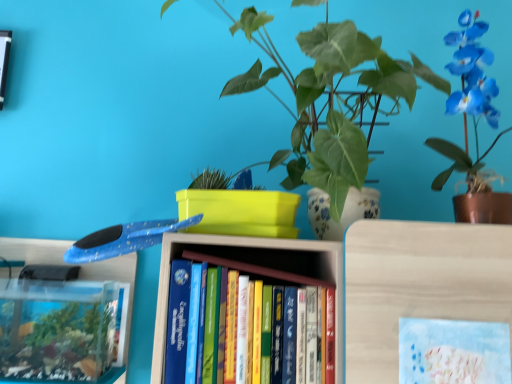
Question: Considering the relative sizes of green glossy leafy plant at center, marked as the 1th houseplant in a left-to-right arrangement, and pastel blue paper at center in the image provided, is green glossy leafy plant at center, marked as the 1th houseplant in a left-to-right arrangement, thinner than pastel blue paper at center?

Choices:
 (A) yes
 (B) no

Answer: (B)

Question: Is green glossy leafy plant at center, marked as the 1th houseplant in a left-to-right arrangement, positioned far away from pastel blue paper at center?

Choices:
 (A) no
 (B) yes

Answer: (A)

Question: From the image's perspective, would you say green glossy leafy plant at center, which is counted as the 2th houseplant, starting from the right, is positioned over pastel blue paper at center?

Choices:
 (A) no
 (B) yes

Answer: (B)

Question: Does green glossy leafy plant at center, which is counted as the 2th houseplant, starting from the right, have a lesser height compared to pastel blue paper at center?

Choices:
 (A) yes
 (B) no

Answer: (B)

Question: Considering the relative sizes of green glossy leafy plant at center, which is counted as the 2th houseplant, starting from the right, and pastel blue paper at center in the image provided, is green glossy leafy plant at center, which is counted as the 2th houseplant, starting from the right, taller than pastel blue paper at center?

Choices:
 (A) yes
 (B) no

Answer: (A)

Question: Considering their positions, is pastel blue paper at center located in front of or behind blue glossy orchid at upper right, arranged as the second houseplant when viewed from the left?

Choices:
 (A) front
 (B) behind

Answer: (A)

Question: Is point (420, 352) closer or farther from the camera than point (477, 198)?

Choices:
 (A) farther
 (B) closer

Answer: (B)

Question: In the image, is pastel blue paper at center on the left side or the right side of blue glossy orchid at upper right, which is the first houseplant from right to left?

Choices:
 (A) right
 (B) left

Answer: (B)

Question: From the image's perspective, is pastel blue paper at center positioned above or below blue glossy orchid at upper right, arranged as the second houseplant when viewed from the left?

Choices:
 (A) below
 (B) above

Answer: (A)

Question: Relative to pastel blue paper at center, is green glossy leafy plant at center, marked as the 1th houseplant in a left-to-right arrangement, in front or behind?

Choices:
 (A) behind
 (B) front

Answer: (B)

Question: Is green glossy leafy plant at center, which is counted as the 2th houseplant, starting from the right, to the left or to the right of pastel blue paper at center in the image?

Choices:
 (A) right
 (B) left

Answer: (B)

Question: From a real-world perspective, is green glossy leafy plant at center, marked as the 1th houseplant in a left-to-right arrangement, above or below pastel blue paper at center?

Choices:
 (A) above
 (B) below

Answer: (A)

Question: Is point (313, 114) closer or farther from the camera than point (505, 377)?

Choices:
 (A) closer
 (B) farther

Answer: (B)

Question: In terms of height, does green glossy leafy plant at center, marked as the 1th houseplant in a left-to-right arrangement, look taller or shorter compared to blue glossy orchid at upper right, arranged as the second houseplant when viewed from the left?

Choices:
 (A) short
 (B) tall

Answer: (B)

Question: Is green glossy leafy plant at center, marked as the 1th houseplant in a left-to-right arrangement, spatially inside blue glossy orchid at upper right, which is the first houseplant from right to left, or outside of it?

Choices:
 (A) outside
 (B) inside

Answer: (A)